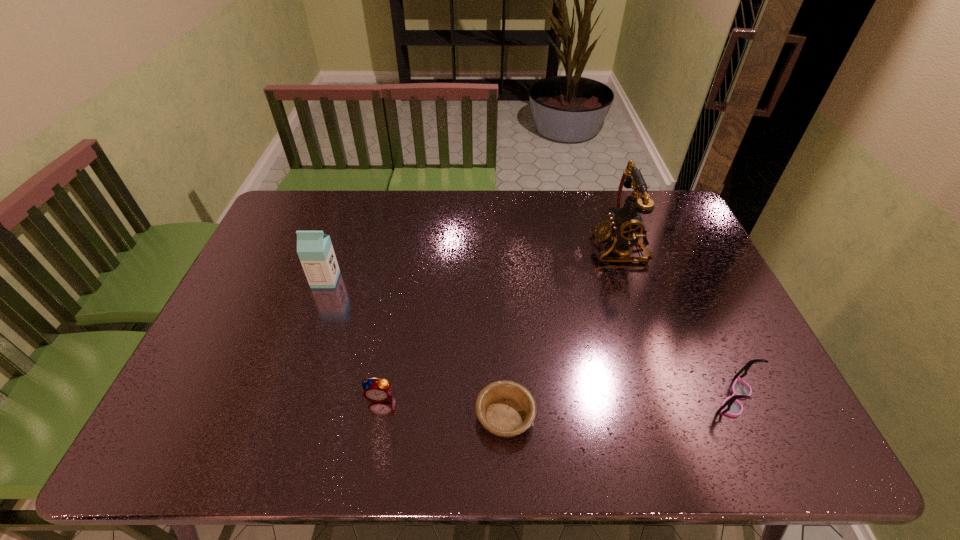
The height and width of the screenshot is (540, 960). What are the coordinates of `empty location between the tallest object and the leftmost object` in the screenshot? It's located at (472, 263).

Identify the location of unoccupied area between the milk carton and the tallest object. (472, 263).

Locate an element on the screen. This screenshot has height=540, width=960. free space that is in between the tallest object and the rightmost object is located at coordinates (677, 322).

This screenshot has height=540, width=960. Identify the location of free area in between the rightmost object and the fourth object from right to left. (557, 397).

Where is `unoccupied area between the tallest object and the second tallest object`? This screenshot has width=960, height=540. unoccupied area between the tallest object and the second tallest object is located at coordinates (472, 263).

Image resolution: width=960 pixels, height=540 pixels. I want to click on vacant space that's between the milk carton and the rightmost object, so [x=530, y=339].

Find the location of a particular element. The width and height of the screenshot is (960, 540). free space between the fourth object from left to right and the shortest object is located at coordinates pos(563,332).

I want to click on the fourth closest object to the rightmost object, so click(314, 248).

Image resolution: width=960 pixels, height=540 pixels. In order to click on the fourth closest object relative to the telephone in this screenshot , I will do `click(314, 248)`.

Where is `free space that satisfies the following two spatial constraints: 1. on the front of the telephone, featuring the rotary dial; 2. on the front-facing side of the second object from left to right`? This screenshot has height=540, width=960. free space that satisfies the following two spatial constraints: 1. on the front of the telephone, featuring the rotary dial; 2. on the front-facing side of the second object from left to right is located at coordinates (671, 396).